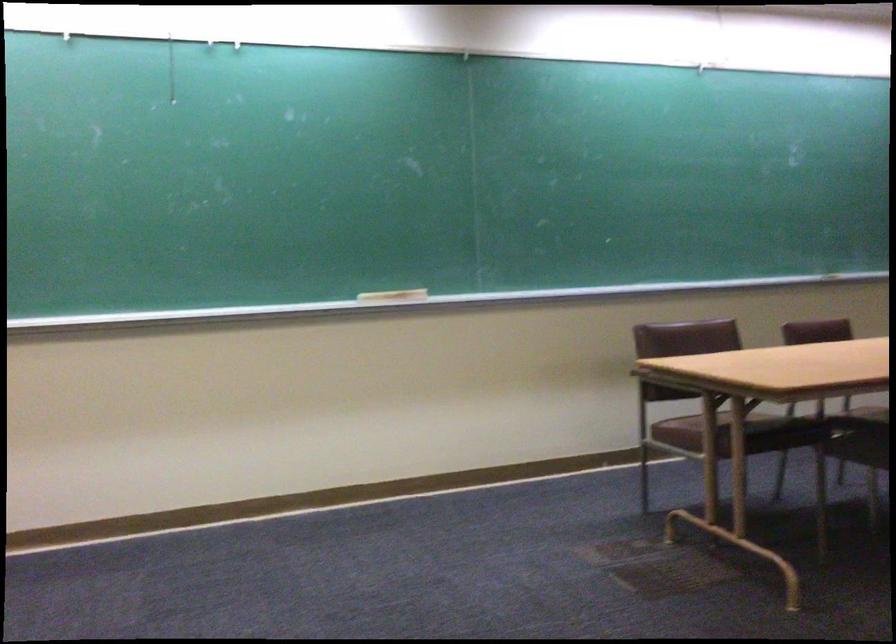
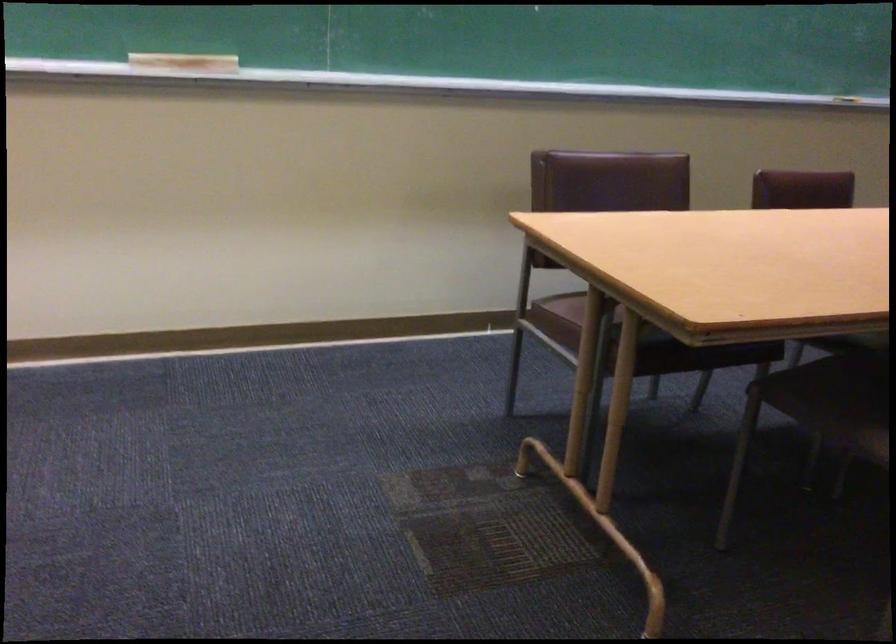
Where in the second image is the point corresponding to [392,295] from the first image?

(183, 64)